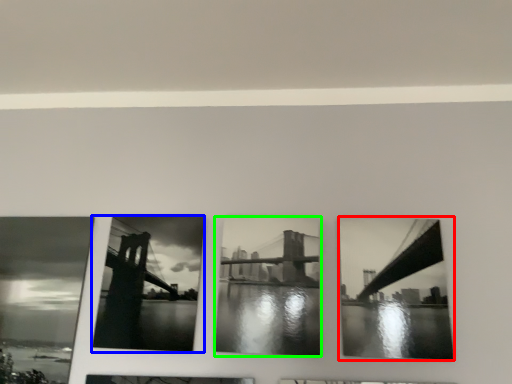
Question: Which is farther away from picture frame (highlighted by a red box)? picture frame (highlighted by a blue box) or picture frame (highlighted by a green box)?

Choices:
 (A) picture frame
 (B) picture frame

Answer: (A)